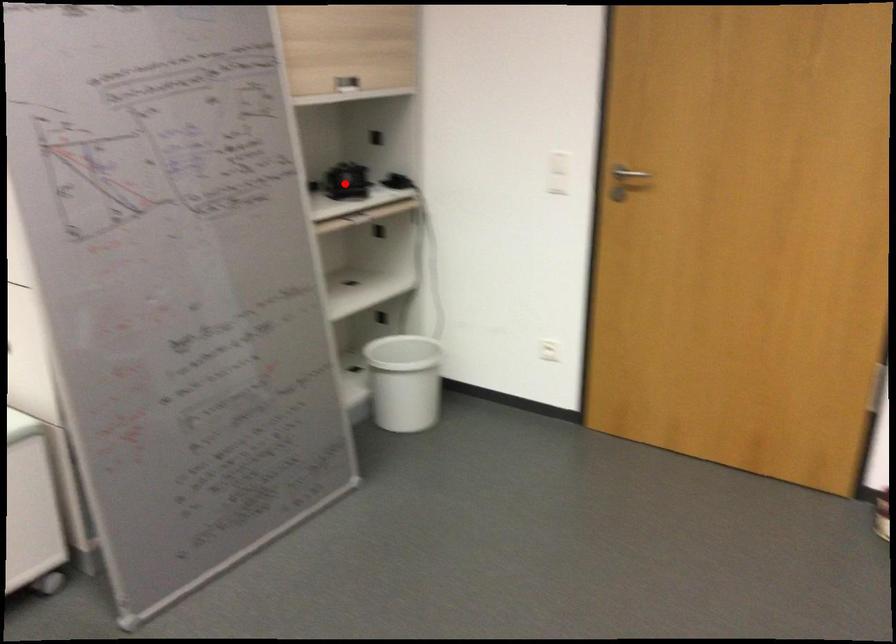
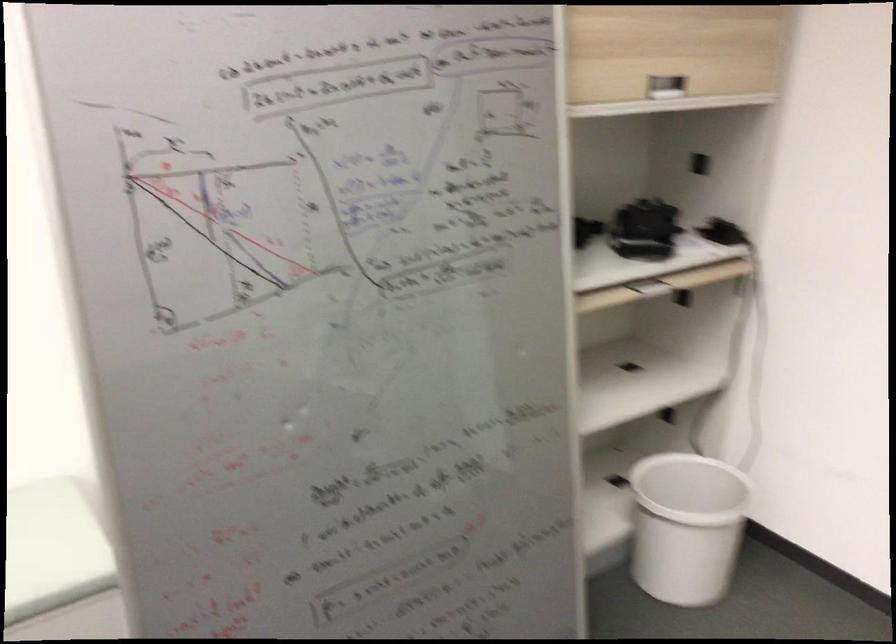
Question: I am providing you with two images of the same scene from different viewpoints. A red point is shown in image1. For the corresponding object point in image2, is it positioned nearer or farther from the camera?

Choices:
 (A) Nearer
 (B) Farther

Answer: (A)